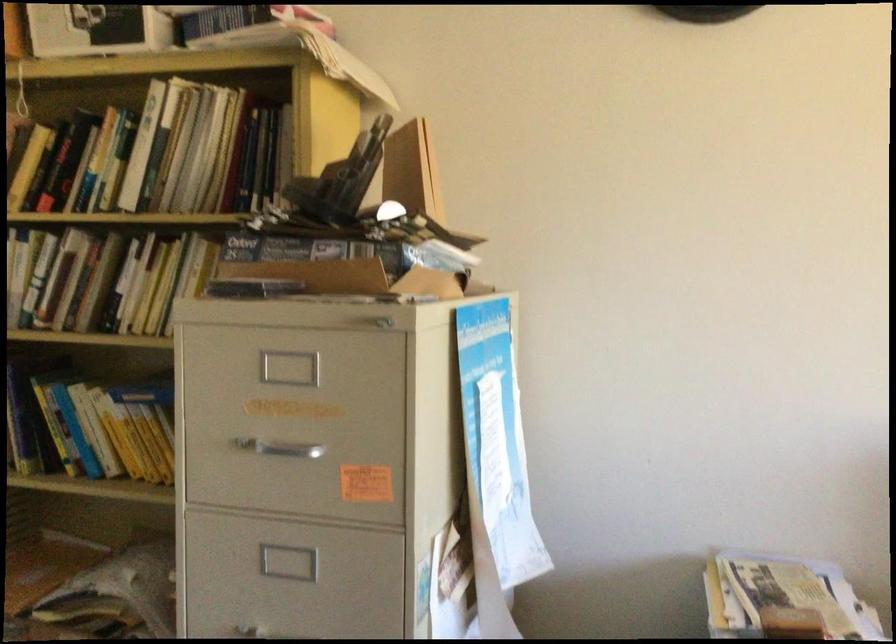
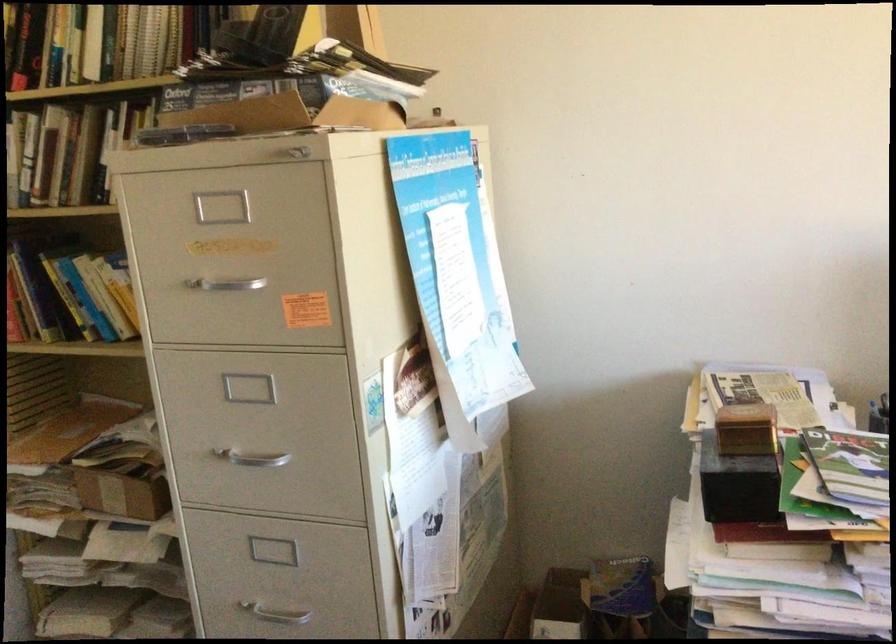
Where in the second image is the point corresponding to point (281, 447) from the first image?

(224, 283)